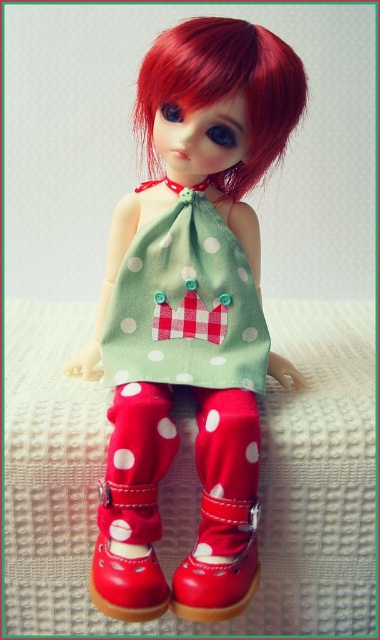
Question: Can you confirm if white textured bed at center is positioned to the left of white polka dot fabric socks at lower center?

Choices:
 (A) yes
 (B) no

Answer: (B)

Question: Is green polka dot fabric dress at center above red leather shoe at lower center?

Choices:
 (A) no
 (B) yes

Answer: (B)

Question: Based on their relative distances, which object is farther from the green polka dot fabric dress at center?

Choices:
 (A) red matte shoe at lower center
 (B) white polka dot fabric socks at lower center

Answer: (A)

Question: Is the position of white polka dot fabric socks at lower center more distant than that of red leather shoe at lower center?

Choices:
 (A) no
 (B) yes

Answer: (B)

Question: Which point is farther from the camera taking this photo?

Choices:
 (A) (109, 550)
 (B) (180, 92)
 (C) (177, 371)
 (D) (171, 602)

Answer: (C)

Question: Which point appears farthest from the camera in this image?

Choices:
 (A) (109, 524)
 (B) (171, 285)
 (C) (152, 580)
 (D) (266, 100)

Answer: (B)